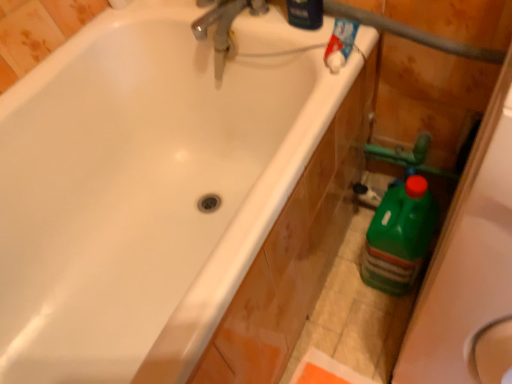
What do you see at coordinates (340, 44) in the screenshot? I see `blue glossy bottle at upper right, placed as the 1th cleaning product when sorted from top to bottom` at bounding box center [340, 44].

Image resolution: width=512 pixels, height=384 pixels. I want to click on blue glossy bottle at upper right, which ranks as the 1th cleaning product in front-to-back order, so click(340, 44).

Measure the distance between point (413, 183) and camera.

39.09 inches.

Measure the distance between point (108, 134) and camera.

They are 1.11 meters apart.

At what (x,y) coordinates should I click in order to perform the action: click on metallic chrome faucet at upper center. Please return your answer as a coordinate pair (x, y). The height and width of the screenshot is (384, 512). Looking at the image, I should click on pyautogui.click(x=224, y=26).

I want to click on blue glossy bottle at upper right, placed as the 1th cleaning product when sorted from top to bottom, so click(x=340, y=44).

Based on the photo, can you confirm if green plastic bottle at right, the 2th cleaning product positioned from the front, is smaller than blue glossy bottle at upper right, placed as the 1th cleaning product when sorted from top to bottom?

No, green plastic bottle at right, the 2th cleaning product positioned from the front, is not smaller than blue glossy bottle at upper right, placed as the 1th cleaning product when sorted from top to bottom.

From a real-world perspective, is green plastic bottle at right, which is the 2th cleaning product from left to right, physically above blue glossy bottle at upper right, placed as the second cleaning product when sorted from bottom to top?

No, from a real-world perspective, green plastic bottle at right, which is the 2th cleaning product from left to right, is not over blue glossy bottle at upper right, placed as the second cleaning product when sorted from bottom to top

Could you measure the distance between green plastic bottle at right, the 2th cleaning product positioned from the front, and blue glossy bottle at upper right, which is the 2th cleaning product in right-to-left order?

The distance of green plastic bottle at right, the 2th cleaning product positioned from the front, from blue glossy bottle at upper right, which is the 2th cleaning product in right-to-left order, is 17.16 inches.

Is green plastic bottle at right, which ranks as the 1th cleaning product in right-to-left order, directly adjacent to blue glossy bottle at upper right, which ranks as the 1th cleaning product in front-to-back order?

No, green plastic bottle at right, which ranks as the 1th cleaning product in right-to-left order, is not in contact with blue glossy bottle at upper right, which ranks as the 1th cleaning product in front-to-back order.

Does green plastic bottle at right, the 2th cleaning product positioned from the front, come behind metallic chrome faucet at upper center?

Yes, the depth of green plastic bottle at right, the 2th cleaning product positioned from the front, is greater than that of metallic chrome faucet at upper center.

Does green plastic bottle at right, the 2th cleaning product positioned from the front, turn towards metallic chrome faucet at upper center?

No, green plastic bottle at right, the 2th cleaning product positioned from the front, is not facing towards metallic chrome faucet at upper center.

Find the location of a particular element. tap that appears above the green plastic bottle at right, which is the 2th cleaning product from left to right (from a real-world perspective) is located at coordinates (224, 26).

Is green plastic bottle at right, which is the 2th cleaning product from left to right, spatially inside metallic chrome faucet at upper center, or outside of it?

green plastic bottle at right, which is the 2th cleaning product from left to right, is not enclosed by metallic chrome faucet at upper center.

From a real-world perspective, between blue glossy bottle at upper right, placed as the second cleaning product when sorted from back to front, and white glossy bathtub at upper left, who is vertically lower?

white glossy bathtub at upper left.

Does blue glossy bottle at upper right, which ranks as the 1th cleaning product in front-to-back order, lie behind white glossy bathtub at upper left?

Yes, it is behind white glossy bathtub at upper left.

From the image's perspective, is blue glossy bottle at upper right, which ranks as the 1th cleaning product in front-to-back order, located above white glossy bathtub at upper left?

Yes, from the image's perspective, blue glossy bottle at upper right, which ranks as the 1th cleaning product in front-to-back order, is on top of white glossy bathtub at upper left.

Locate an element on the screen. This screenshot has width=512, height=384. bathtub above the green plastic bottle at right, which is the 2th cleaning product from left to right (from the image's perspective) is located at coordinates (166, 200).

Is green plastic bottle at right, which is the first cleaning product from back to front, completely or partially outside of white glossy bathtub at upper left?

green plastic bottle at right, which is the first cleaning product from back to front, is positioned outside white glossy bathtub at upper left.

Is green plastic bottle at right, which is the 2th cleaning product from left to right, facing away from white glossy bathtub at upper left?

green plastic bottle at right, which is the 2th cleaning product from left to right, is not turned away from white glossy bathtub at upper left.

Considering the relative sizes of white glossy bathtub at upper left and blue glossy bottle at upper right, placed as the 1th cleaning product when sorted from left to right, in the image provided, is white glossy bathtub at upper left smaller than blue glossy bottle at upper right, placed as the 1th cleaning product when sorted from left to right,?

Actually, white glossy bathtub at upper left might be larger than blue glossy bottle at upper right, placed as the 1th cleaning product when sorted from left to right.

How far apart are white glossy bathtub at upper left and blue glossy bottle at upper right, placed as the second cleaning product when sorted from back to front?

18.40 inches.

Does white glossy bathtub at upper left have a lesser height compared to blue glossy bottle at upper right, which is the 2th cleaning product in right-to-left order?

In fact, white glossy bathtub at upper left may be taller than blue glossy bottle at upper right, which is the 2th cleaning product in right-to-left order.

Is the surface of white glossy bathtub at upper left in direct contact with blue glossy bottle at upper right, which is the 2th cleaning product in right-to-left order?

No, white glossy bathtub at upper left is not in contact with blue glossy bottle at upper right, which is the 2th cleaning product in right-to-left order.

From the image's perspective, is metallic chrome faucet at upper center located above or below white glossy bathtub at upper left?

Based on their image positions, metallic chrome faucet at upper center is located above white glossy bathtub at upper left.

Based on the photo, from a real-world perspective, is metallic chrome faucet at upper center positioned above or below white glossy bathtub at upper left?

In terms of real-world spatial position, metallic chrome faucet at upper center is above white glossy bathtub at upper left.

Which object is positioned more to the right, metallic chrome faucet at upper center or white glossy bathtub at upper left?

metallic chrome faucet at upper center is more to the right.

Would you say metallic chrome faucet at upper center is outside white glossy bathtub at upper left?

Indeed, metallic chrome faucet at upper center is completely outside white glossy bathtub at upper left.

Considering the relative sizes of blue glossy bottle at upper right, placed as the second cleaning product when sorted from bottom to top, and metallic chrome faucet at upper center in the image provided, is blue glossy bottle at upper right, placed as the second cleaning product when sorted from bottom to top, bigger than metallic chrome faucet at upper center?

No, blue glossy bottle at upper right, placed as the second cleaning product when sorted from bottom to top, is not bigger than metallic chrome faucet at upper center.

Is metallic chrome faucet at upper center at the back of blue glossy bottle at upper right, which is the 2th cleaning product in right-to-left order?

No, metallic chrome faucet at upper center is not at the back of blue glossy bottle at upper right, which is the 2th cleaning product in right-to-left order.

Locate an element on the screen. The image size is (512, 384). tap above the blue glossy bottle at upper right, which is the 2th cleaning product in right-to-left order (from the image's perspective) is located at coordinates (224, 26).

From the image's perspective, which one is positioned higher, blue glossy bottle at upper right, placed as the 1th cleaning product when sorted from top to bottom, or metallic chrome faucet at upper center?

metallic chrome faucet at upper center, from the image's perspective.

I want to click on cleaning product above the green plastic bottle at right, the 2th cleaning product positioned from the front (from the image's perspective), so click(x=340, y=44).

Image resolution: width=512 pixels, height=384 pixels. In order to click on cleaning product that is the 2nd one when counting rightward from the metallic chrome faucet at upper center in this screenshot , I will do `click(399, 237)`.

When comparing their distances from metallic chrome faucet at upper center, does blue glossy bottle at upper right, placed as the 1th cleaning product when sorted from left to right, or green plastic bottle at right, which ranks as the 1th cleaning product in right-to-left order, seem closer?

blue glossy bottle at upper right, placed as the 1th cleaning product when sorted from left to right, is closer to metallic chrome faucet at upper center.

Looking at the image, which one is located further to white glossy bathtub at upper left, blue glossy bottle at upper right, placed as the second cleaning product when sorted from back to front, or metallic chrome faucet at upper center?

blue glossy bottle at upper right, placed as the second cleaning product when sorted from back to front, is further to white glossy bathtub at upper left.

From the image, which object appears to be nearer to green plastic bottle at right, which is the 2th cleaning product from left to right, white glossy bathtub at upper left or blue glossy bottle at upper right, which ranks as the 1th cleaning product in front-to-back order?

blue glossy bottle at upper right, which ranks as the 1th cleaning product in front-to-back order, is closer to green plastic bottle at right, which is the 2th cleaning product from left to right.

Estimate the real-world distances between objects in this image. Which object is closer to green plastic bottle at right, which is the first cleaning product from back to front, metallic chrome faucet at upper center or blue glossy bottle at upper right, placed as the 1th cleaning product when sorted from top to bottom?

blue glossy bottle at upper right, placed as the 1th cleaning product when sorted from top to bottom.

Estimate the real-world distances between objects in this image. Which object is closer to blue glossy bottle at upper right, which ranks as the 1th cleaning product in front-to-back order, white glossy bathtub at upper left or green plastic bottle at right, the 2th cleaning product positioned from the front?

Based on the image, green plastic bottle at right, the 2th cleaning product positioned from the front, appears to be nearer to blue glossy bottle at upper right, which ranks as the 1th cleaning product in front-to-back order.

Based on their spatial positions, is white glossy bathtub at upper left or metallic chrome faucet at upper center further from green plastic bottle at right, which is the 2th cleaning product from left to right?

metallic chrome faucet at upper center is further to green plastic bottle at right, which is the 2th cleaning product from left to right.

From the image, which object appears to be farther from white glossy bathtub at upper left, green plastic bottle at right, which is the 2th cleaning product from left to right, or blue glossy bottle at upper right, which is the 2th cleaning product in right-to-left order?

The object further to white glossy bathtub at upper left is blue glossy bottle at upper right, which is the 2th cleaning product in right-to-left order.

Considering their positions, is white glossy bathtub at upper left positioned further to metallic chrome faucet at upper center than blue glossy bottle at upper right, placed as the second cleaning product when sorted from bottom to top?

white glossy bathtub at upper left is further to metallic chrome faucet at upper center.

Identify the location of cleaning product between white glossy bathtub at upper left and green plastic bottle at right, the 2th cleaning product positioned from the front. The width and height of the screenshot is (512, 384). (340, 44).

This screenshot has height=384, width=512. Identify the location of tap between white glossy bathtub at upper left and green plastic bottle at right, which ranks as the 1th cleaning product in right-to-left order. (224, 26).

Locate an element on the screen. Image resolution: width=512 pixels, height=384 pixels. cleaning product that lies between metallic chrome faucet at upper center and white glossy bathtub at upper left from top to bottom is located at coordinates (340, 44).

The image size is (512, 384). In order to click on cleaning product between metallic chrome faucet at upper center and green plastic bottle at right, the 2th cleaning product viewed from the top, in the up-down direction in this screenshot , I will do `click(340, 44)`.